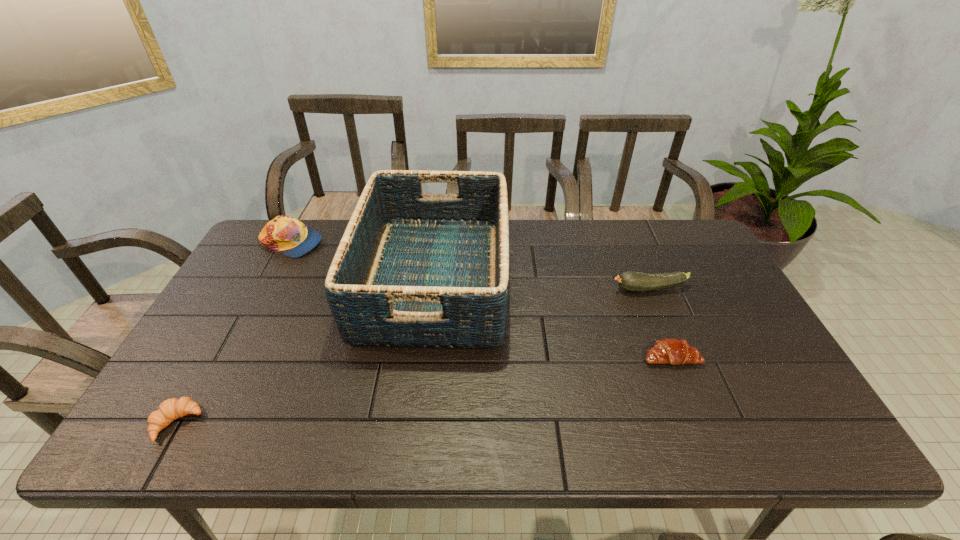
Locate an element on the screen. The width and height of the screenshot is (960, 540). vacant space that is in between the cap and the nearer crescent roll is located at coordinates [234, 333].

The height and width of the screenshot is (540, 960). I want to click on vacant area between the nearest object and the third object from left to right, so click(x=305, y=351).

Find the location of a particular element. The image size is (960, 540). free space between the third tallest object and the tallest object is located at coordinates (541, 284).

This screenshot has height=540, width=960. I want to click on vacant space that is in between the tallest object and the nearest object, so click(305, 351).

Find the location of a particular element. object that is the fourth closest to the farther crescent roll is located at coordinates (x=169, y=410).

Select which object appears as the second closest to the nearer crescent roll. Please provide its 2D coordinates. Your answer should be formatted as a tuple, i.e. [(x, y)], where the tuple contains the x and y coordinates of a point satisfying the conditions above.

[(287, 235)]

Locate an element on the screen. The image size is (960, 540). vacant space that satisfies the following two spatial constraints: 1. on the bill of the second tallest object; 2. on the left side of the basket is located at coordinates (273, 279).

Locate an element on the screen. vacant space that satisfies the following two spatial constraints: 1. on the back side of the farther crescent roll; 2. on the bill of the cap is located at coordinates (625, 243).

Find the location of a particular element. free space in the image that satisfies the following two spatial constraints: 1. on the bill of the cap; 2. on the right side of the third object from left to right is located at coordinates (273, 279).

Locate an element on the screen. The height and width of the screenshot is (540, 960). free spot that satisfies the following two spatial constraints: 1. on the bill of the right crescent roll; 2. on the left side of the fourth shortest object is located at coordinates (232, 357).